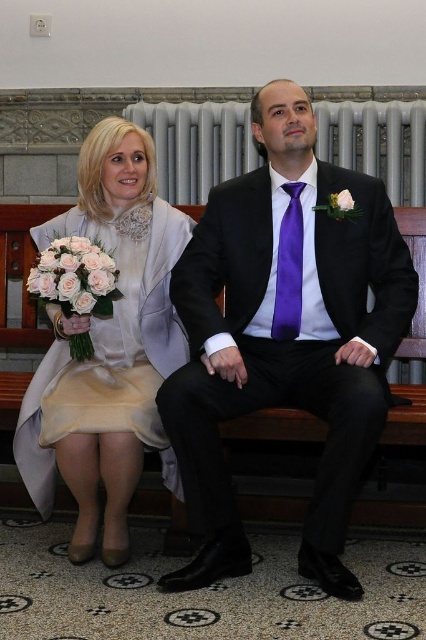
Which of these two, satin white dress at left or white silk flower at center, stands shorter?

white silk flower at center is shorter.

Between satin white dress at left and white silk flower at center, which one appears on the left side from the viewer's perspective?

satin white dress at left

Where is `satin white dress at left`? The width and height of the screenshot is (426, 640). satin white dress at left is located at coordinates (108, 348).

Locate an element on the screen. satin white dress at left is located at coordinates (108, 348).

Between satin white dress at left and metallic radiator at upper center, which one appears on the right side from the viewer's perspective?

metallic radiator at upper center

Who is taller, satin white dress at left or metallic radiator at upper center?

satin white dress at left

Find the location of a particular element. The image size is (426, 640). satin white dress at left is located at coordinates (108, 348).

Between matte black suit at center and pale pink silk bouquet at left, which one appears on the right side from the viewer's perspective?

matte black suit at center is more to the right.

Between matte black suit at center and pale pink silk bouquet at left, which one appears on the left side from the viewer's perspective?

pale pink silk bouquet at left is more to the left.

At what (x,y) coordinates should I click in order to perform the action: click on matte black suit at center. Please return your answer as a coordinate pair (x, y). The image size is (426, 640). Looking at the image, I should click on (284, 340).